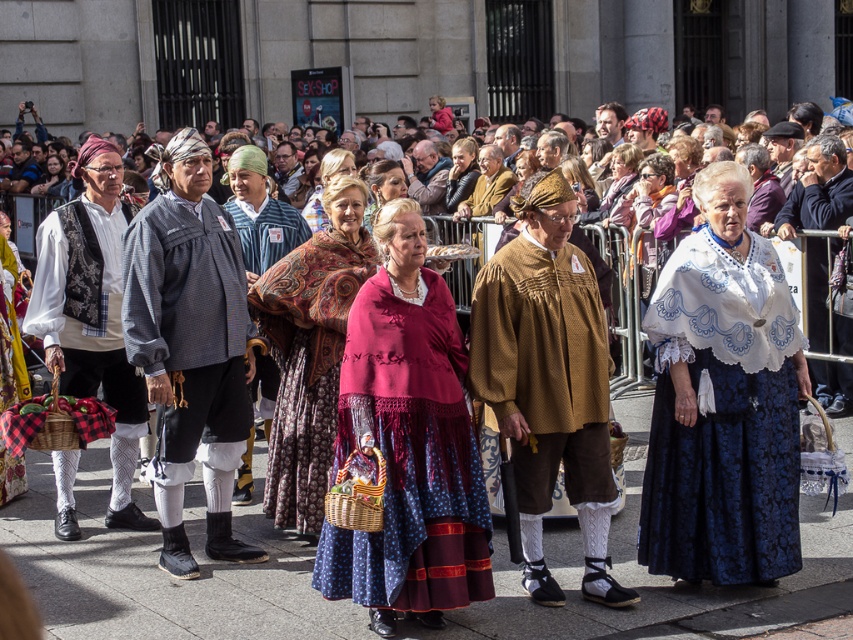
You are standing at the starting point of the festival parade route. You need to walk to the first checkpoint located at point [221,305] and then proceed to the second checkpoint at point [61,170]. Based on the scene description, which checkpoint is closer to your starting position?

Point [221,305] is in front of point [61,170], so the first checkpoint at point [221,305] is closer to your starting position.

You are a photographer standing at the edge of the street. You want to capture the blue woven shirt at center in your shot. What is the exact coordinate where you should focus your camera?

The blue woven shirt at center is located at coordinate point [189,317], so you should focus your camera there.